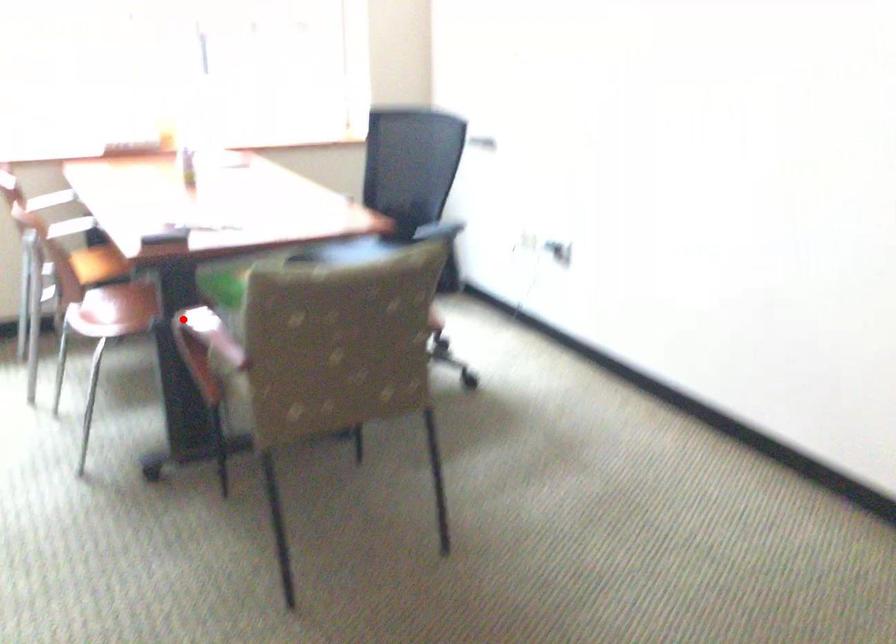
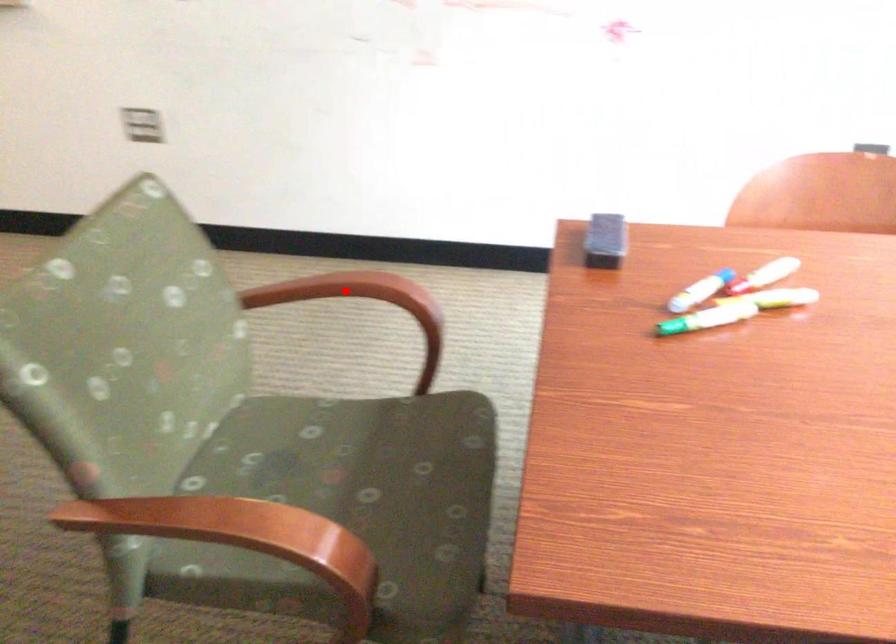
I am providing you with two images of the same scene from different viewpoints. A red point is marked on the first image and another point is marked on the second image. Is the red point in image1 aligned with the point shown in image2?

Yes